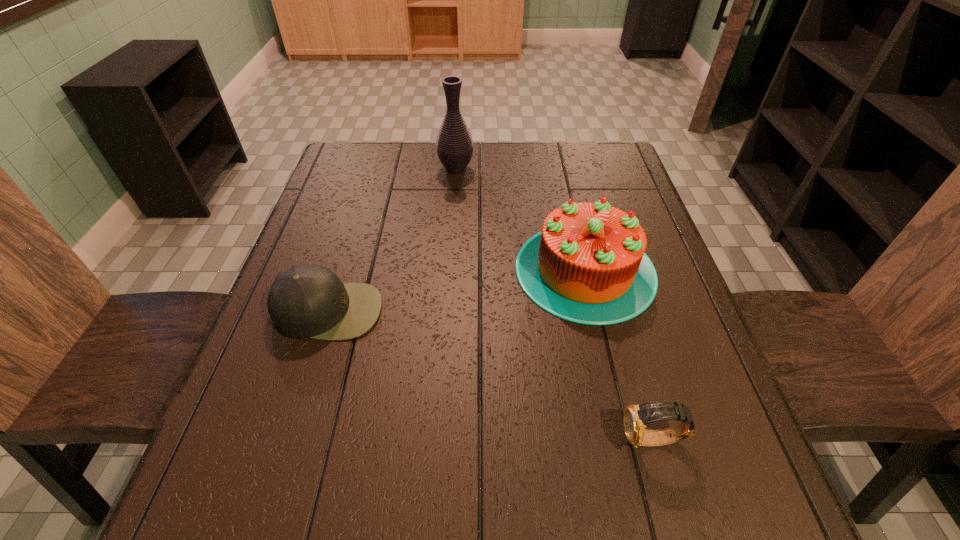
Image resolution: width=960 pixels, height=540 pixels. What are the coordinates of `vase` in the screenshot? It's located at (454, 146).

The width and height of the screenshot is (960, 540). I want to click on the tallest object, so click(x=454, y=146).

Identify the location of the second tallest object. (588, 265).

I want to click on cap, so click(x=306, y=301).

Find the location of a particular element. watch is located at coordinates (636, 418).

Where is `vacant position located 0.160m on the left of the vase`? This screenshot has width=960, height=540. vacant position located 0.160m on the left of the vase is located at coordinates (384, 168).

Identify the location of vacant space located on the left of the third shortest object. The image size is (960, 540). (429, 270).

The width and height of the screenshot is (960, 540). I want to click on blank area located on the brim of the cap, so click(269, 501).

The height and width of the screenshot is (540, 960). What are the coordinates of `vacant space positioned 0.230m on the face of the nearest object` in the screenshot? It's located at (486, 440).

Locate an element on the screen. vacant space located on the face of the nearest object is located at coordinates (462, 440).